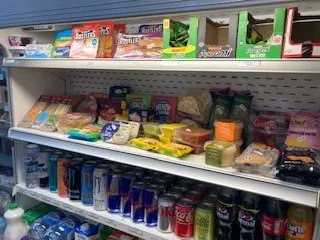
In order to click on box in this screenshot , I will do `click(302, 49)`, `click(263, 49)`, `click(218, 53)`, `click(177, 50)`.